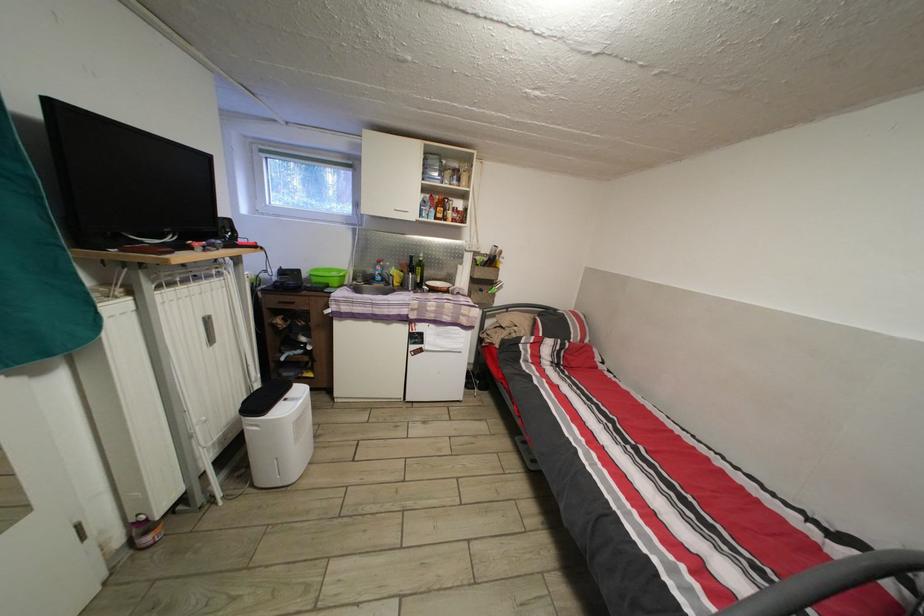
Image resolution: width=924 pixels, height=616 pixels. In order to click on faucet lever in this screenshot , I will do `click(386, 277)`.